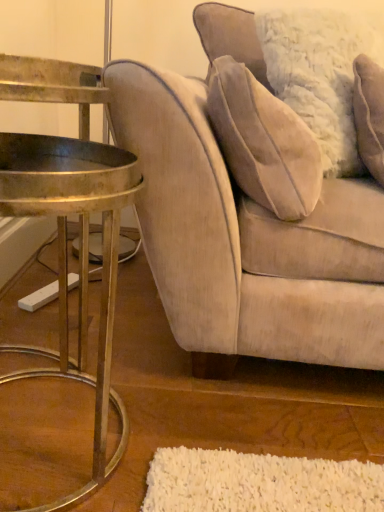
Question: From a real-world perspective, is velvet beige pillow at upper right positioned over gold metallic table at left based on gravity?

Choices:
 (A) yes
 (B) no

Answer: (A)

Question: Is velvet beige pillow at upper right aimed at gold metallic table at left?

Choices:
 (A) yes
 (B) no

Answer: (B)

Question: Does velvet beige pillow at upper right have a larger size compared to gold metallic table at left?

Choices:
 (A) no
 (B) yes

Answer: (B)

Question: Does velvet beige pillow at upper right have a greater height compared to gold metallic table at left?

Choices:
 (A) no
 (B) yes

Answer: (B)

Question: Is velvet beige pillow at upper right positioned far away from gold metallic table at left?

Choices:
 (A) no
 (B) yes

Answer: (A)

Question: Considering their positions, is velvet beige pillow at upper right located in front of or behind velvet beige couch at right?

Choices:
 (A) behind
 (B) front

Answer: (A)

Question: Is velvet beige pillow at upper right bigger or smaller than velvet beige couch at right?

Choices:
 (A) small
 (B) big

Answer: (A)

Question: From a real-world perspective, is velvet beige pillow at upper right positioned above or below velvet beige couch at right?

Choices:
 (A) above
 (B) below

Answer: (A)

Question: Is point (375, 42) closer or farther from the camera than point (210, 31)?

Choices:
 (A) farther
 (B) closer

Answer: (B)

Question: Is point (14, 141) positioned closer to the camera than point (206, 133)?

Choices:
 (A) farther
 (B) closer

Answer: (A)

Question: Considering the positions of gold metallic table at left and velvet beige couch at right in the image, is gold metallic table at left bigger or smaller than velvet beige couch at right?

Choices:
 (A) small
 (B) big

Answer: (A)

Question: From the image's perspective, is gold metallic table at left located above or below velvet beige couch at right?

Choices:
 (A) below
 (B) above

Answer: (A)

Question: From a real-world perspective, is gold metallic table at left above or below velvet beige couch at right?

Choices:
 (A) below
 (B) above

Answer: (A)

Question: Considering the relative positions of velvet beige couch at right and gold metallic table at left in the image provided, is velvet beige couch at right to the left or to the right of gold metallic table at left?

Choices:
 (A) left
 (B) right

Answer: (B)

Question: From a real-world perspective, relative to gold metallic table at left, is velvet beige couch at right vertically above or below?

Choices:
 (A) below
 (B) above

Answer: (B)